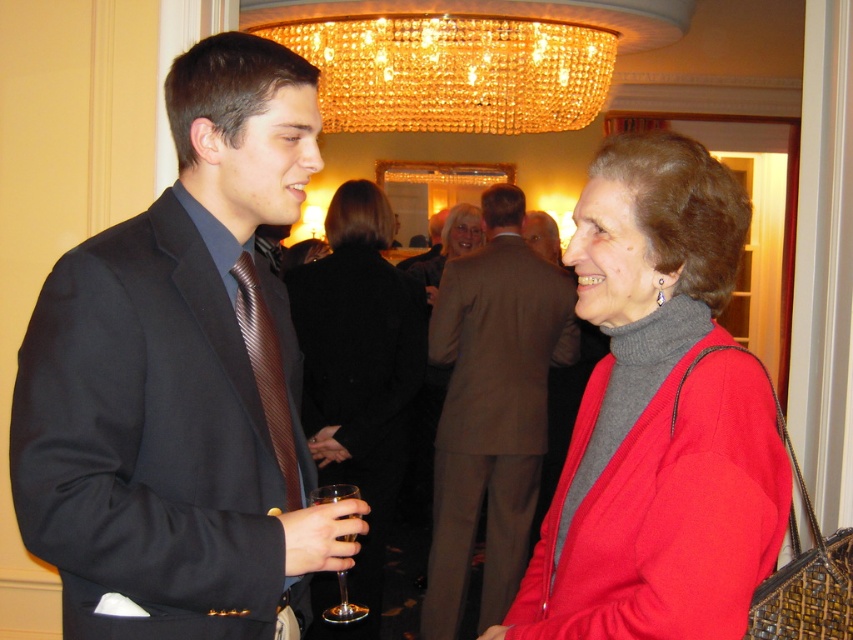
Question: Does matte black suit at left have a greater width compared to matte red sweater at center?

Choices:
 (A) no
 (B) yes

Answer: (B)

Question: Considering the real-world distances, which object is farthest from the clear glass wine glass at lower left?

Choices:
 (A) matte black sweater at center
 (B) matte gray sweater at center

Answer: (B)

Question: Is golden crystal chandelier at upper center closer to camera compared to matte gray sweater at center?

Choices:
 (A) no
 (B) yes

Answer: (B)

Question: Does matte black sweater at center have a greater width compared to clear glass wine glass at lower left?

Choices:
 (A) no
 (B) yes

Answer: (B)

Question: Which of the following is the farthest from the observer?

Choices:
 (A) matte red sweater at center
 (B) matte black suit at left

Answer: (B)

Question: Among these points, which one is farthest from the camera?

Choices:
 (A) (314, 582)
 (B) (498, 561)
 (C) (392, 54)
 (D) (337, 573)

Answer: (C)